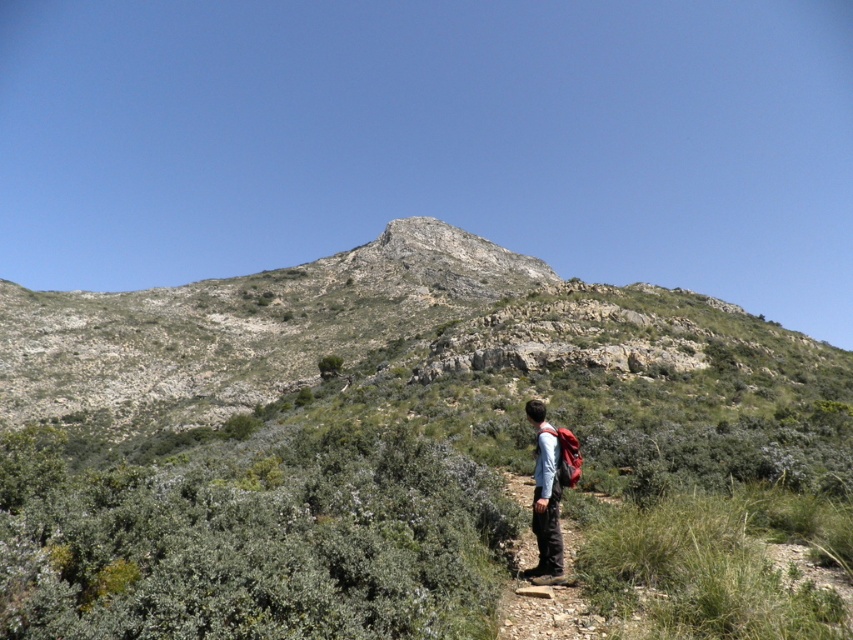
Question: Is rugged stone mountain at center closer to camera compared to matte blue shirt at center?

Choices:
 (A) no
 (B) yes

Answer: (A)

Question: Is rugged stone mountain at center positioned at the back of matte blue shirt at center?

Choices:
 (A) yes
 (B) no

Answer: (A)

Question: Which point is closer to the camera?

Choices:
 (A) (537, 410)
 (B) (90, 368)

Answer: (A)

Question: Is rugged stone mountain at center below matte blue shirt at center?

Choices:
 (A) yes
 (B) no

Answer: (B)